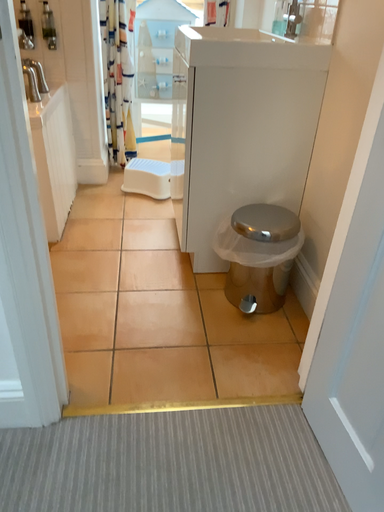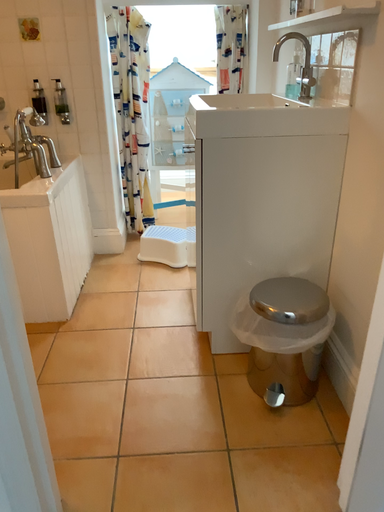
Question: Which way did the camera rotate in the video?

Choices:
 (A) rotated upward
 (B) rotated downward

Answer: (A)